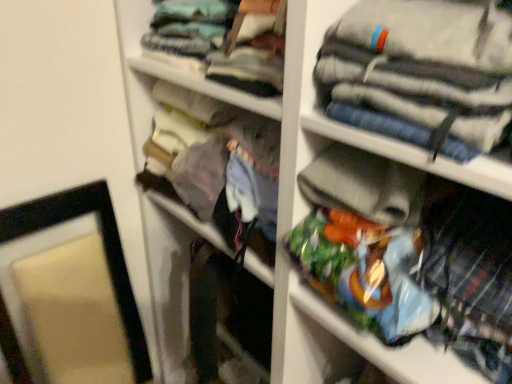
Question: Is plaid fabric shirt at lower right, positioned as the 1th clothing in bottom-to-top order, far away from light blue fabric at upper center, which is the 1th clothing in top-to-bottom order?

Choices:
 (A) yes
 (B) no

Answer: (B)

Question: Is light blue fabric at upper center, which is the 1th clothing in top-to-bottom order, a part of plaid fabric shirt at lower right, positioned as the 1th clothing in bottom-to-top order?

Choices:
 (A) no
 (B) yes

Answer: (A)

Question: Is plaid fabric shirt at lower right, positioned as the 1th clothing in bottom-to-top order, outside light blue fabric at upper center, which is the 1th clothing in top-to-bottom order?

Choices:
 (A) no
 (B) yes

Answer: (B)

Question: Does plaid fabric shirt at lower right, which is the 3th clothing in top-to-bottom order, come in front of light blue fabric at upper center, which is the 1th clothing in top-to-bottom order?

Choices:
 (A) no
 (B) yes

Answer: (B)

Question: Considering the relative sizes of plaid fabric shirt at lower right, positioned as the 1th clothing in bottom-to-top order, and light blue fabric at upper center, which is the 3th clothing in bottom-to-top order, in the image provided, is plaid fabric shirt at lower right, positioned as the 1th clothing in bottom-to-top order, shorter than light blue fabric at upper center, which is the 3th clothing in bottom-to-top order,?

Choices:
 (A) yes
 (B) no

Answer: (B)

Question: Does point (176, 16) appear closer or farther from the camera than point (139, 357)?

Choices:
 (A) closer
 (B) farther

Answer: (A)

Question: Based on their sizes in the image, would you say light blue fabric at upper center, which is the 1th clothing in top-to-bottom order, is bigger or smaller than matte black picture frame at left?

Choices:
 (A) small
 (B) big

Answer: (A)

Question: Relative to matte black picture frame at left, is light blue fabric at upper center, which is the 3th clothing in bottom-to-top order, in front or behind?

Choices:
 (A) behind
 (B) front

Answer: (A)

Question: Looking at their shapes, would you say light blue fabric at upper center, which is the 1th clothing in top-to-bottom order, is wider or thinner than matte black picture frame at left?

Choices:
 (A) thin
 (B) wide

Answer: (A)

Question: From their relative heights in the image, would you say matte fabric purse at center is taller or shorter than striped cotton pants at upper right, acting as the second clothing starting from the bottom?

Choices:
 (A) tall
 (B) short

Answer: (A)

Question: Is matte fabric purse at center bigger or smaller than striped cotton pants at upper right, acting as the second clothing starting from the bottom?

Choices:
 (A) big
 (B) small

Answer: (A)

Question: From the image's perspective, is matte fabric purse at center located above or below striped cotton pants at upper right, the second clothing when ordered from top to bottom?

Choices:
 (A) below
 (B) above

Answer: (A)

Question: Choose the correct answer: Is matte fabric purse at center inside striped cotton pants at upper right, acting as the second clothing starting from the bottom, or outside it?

Choices:
 (A) inside
 (B) outside

Answer: (B)

Question: Is point (142, 360) closer or farther from the camera than point (192, 34)?

Choices:
 (A) closer
 (B) farther

Answer: (B)

Question: In the image, is matte black picture frame at left positioned in front of or behind light blue fabric at upper center, which is the 1th clothing in top-to-bottom order?

Choices:
 (A) front
 (B) behind

Answer: (A)